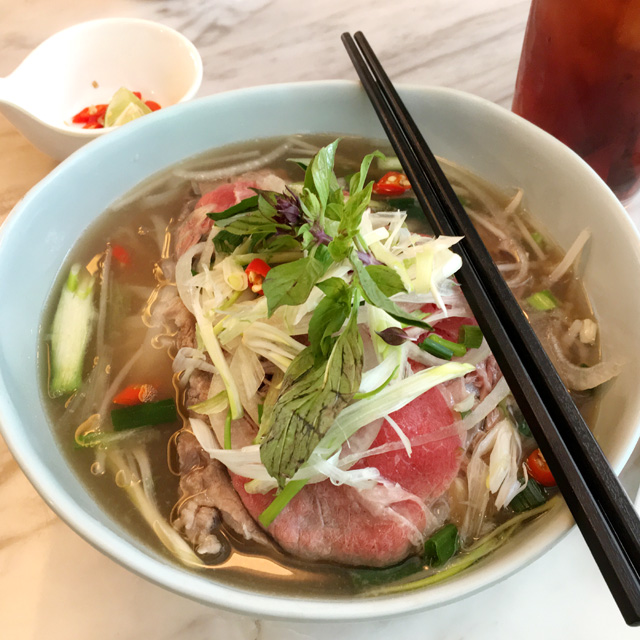
Locate an element on the screen. table is located at coordinates (477, 73).